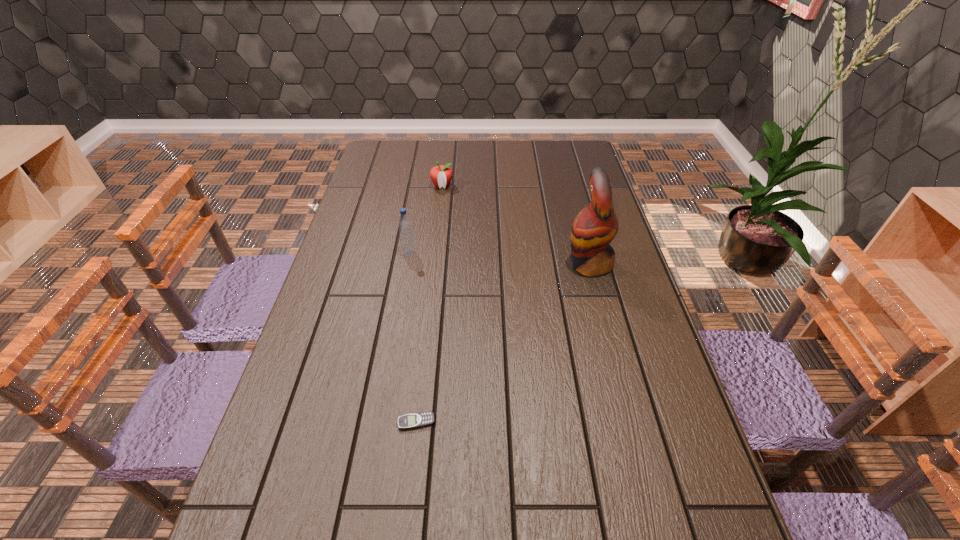
Locate an element on the screen. The height and width of the screenshot is (540, 960). the tallest object is located at coordinates (596, 225).

Where is `the rightmost object`? The image size is (960, 540). the rightmost object is located at coordinates (x=596, y=225).

Find the location of a particular element. The height and width of the screenshot is (540, 960). the leftmost object is located at coordinates (x=405, y=226).

Identify the location of the third shortest object. (405, 226).

Find the location of a particular element. The height and width of the screenshot is (540, 960). the third tallest object is located at coordinates (441, 175).

This screenshot has height=540, width=960. In order to click on apple in this screenshot , I will do `click(441, 175)`.

This screenshot has width=960, height=540. I want to click on the shortest object, so click(x=422, y=419).

Locate an element on the screen. Image resolution: width=960 pixels, height=540 pixels. the nearest object is located at coordinates (422, 419).

Identify the location of blank area located 0.100m on the face of the rightmost object. click(533, 264).

The height and width of the screenshot is (540, 960). Identify the location of vacant point located on the face of the rightmost object. (516, 264).